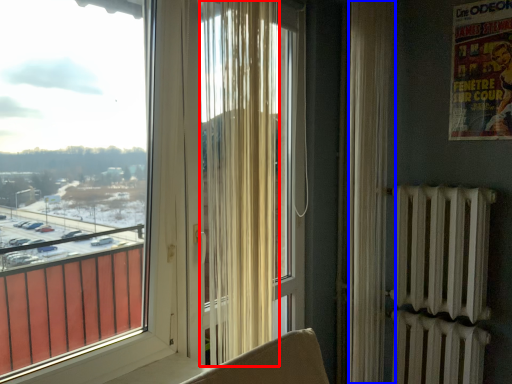
Question: Among these objects, which one is farthest to the camera, curtain (highlighted by a red box) or curtain (highlighted by a blue box)?

Choices:
 (A) curtain
 (B) curtain

Answer: (B)